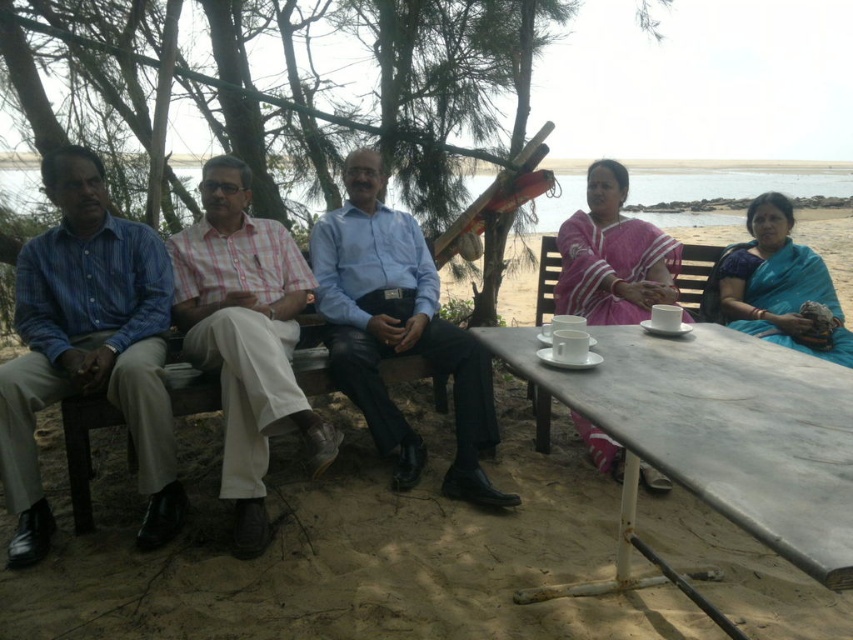
Based on the coordinates provided, which object is located at point [718,436]?

The white marble table at lower right is located at point [718,436].

You are a photographer trying to capture a group photo of the people seated at the white marble table at lower right and the pink checkered shirt at center. Based on their positions, where should you stand to ensure both subjects are fully visible in the frame?

Since the white marble table at lower right is positioned on the right side of the pink checkered shirt at center, you should stand to the left of the pink checkered shirt at center to include both subjects in the frame.